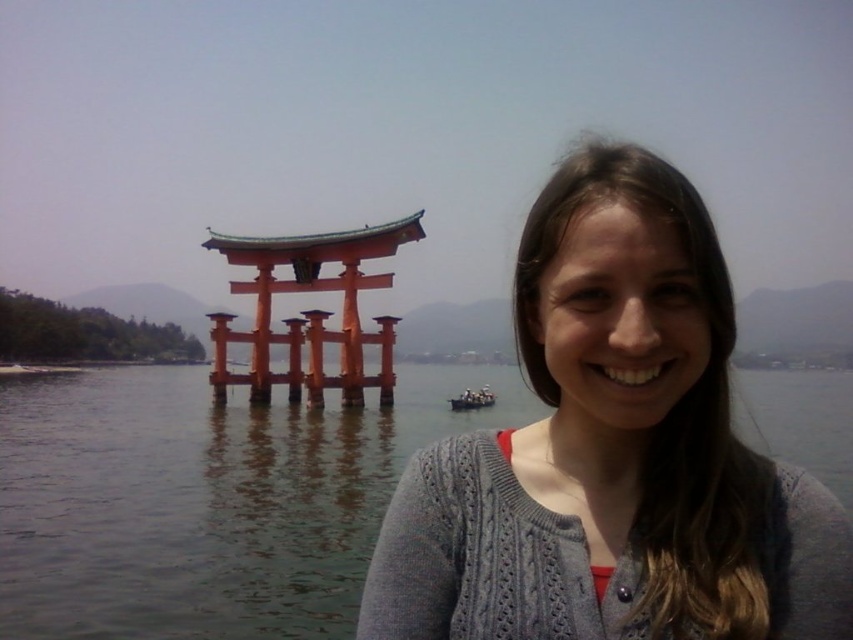
Does gray knitted sweater at center have a greater height compared to transparent water at center?

Correct, gray knitted sweater at center is much taller as transparent water at center.

From the picture: Is gray knitted sweater at center in front of transparent water at center?

Yes, gray knitted sweater at center is closer to the viewer.

Locate an element on the screen. This screenshot has height=640, width=853. gray knitted sweater at center is located at coordinates click(x=613, y=452).

Which is behind, point (397, 497) or point (477, 397)?

The point (477, 397) is behind.

Is gray knitted sweater at center shorter than wooden boat at center?

No.

Is point (572, 524) farther from viewer compared to point (479, 388)?

No.

Image resolution: width=853 pixels, height=640 pixels. Identify the location of gray knitted sweater at center. [613, 452].

You are a GUI agent. You are given a task and a screenshot of the screen. Output one action in this format:
    pyautogui.click(x=<x>, y=<y>)
    Task: Click on the transparent water at center
    
    Given the screenshot: What is the action you would take?
    [206, 500]

Is transparent water at center further to camera compared to wooden boat at center?

No, it is in front of wooden boat at center.

Find the location of `transparent water at center`. transparent water at center is located at coordinates (206, 500).